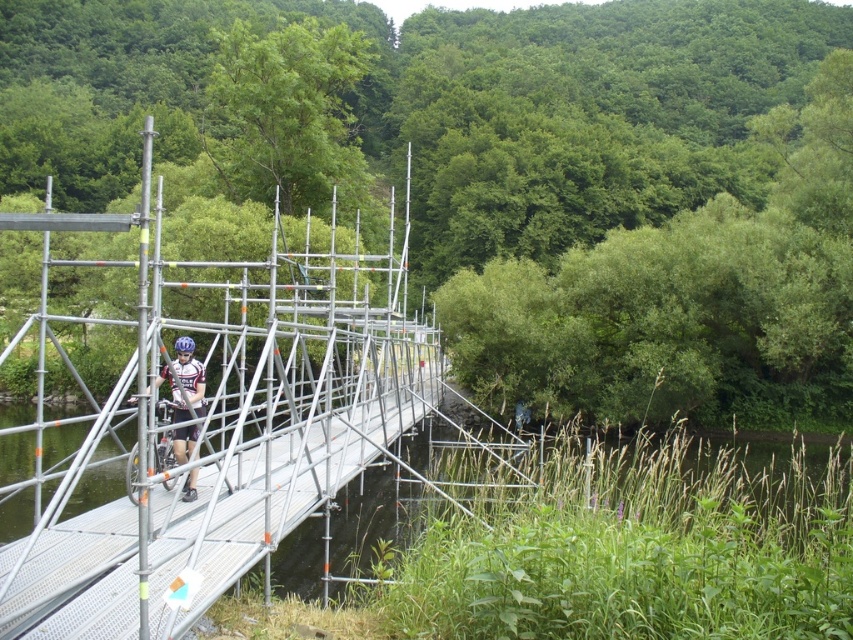
Question: Is metal scaffolding at center thinner than matte black bicycle at center?

Choices:
 (A) no
 (B) yes

Answer: (A)

Question: Where is metal scaffolding at center located in relation to matte black bicycle at center in the image?

Choices:
 (A) below
 (B) above

Answer: (B)

Question: Which point is farther to the camera?

Choices:
 (A) matte black bicycle at center
 (B) metal scaffolding at center

Answer: (A)

Question: Is metal scaffolding at center above matte black bicycle at center?

Choices:
 (A) yes
 (B) no

Answer: (A)